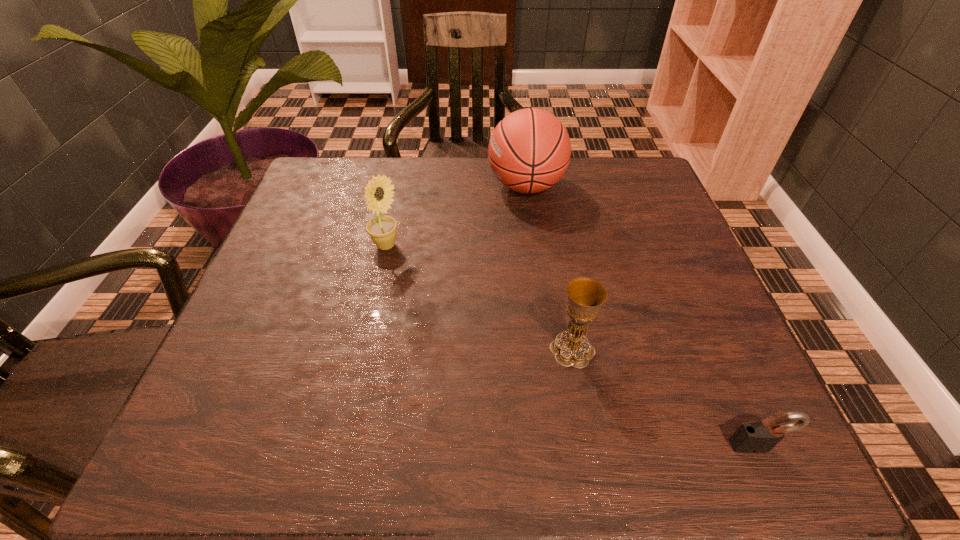
Find the location of a particular element. Image resolution: width=960 pixels, height=540 pixels. blank space located 0.370m on the face of the leftmost object is located at coordinates (566, 246).

You are a GUI agent. You are given a task and a screenshot of the screen. Output one action in this format:
    pyautogui.click(x=<x>, y=<y>)
    Task: Click on the free space located on the left of the second nearest object
    
    Given the screenshot: What is the action you would take?
    pyautogui.click(x=340, y=349)

Locate an element on the screen. object at the far edge is located at coordinates (529, 151).

The image size is (960, 540). What are the coordinates of `object that is at the near edge` in the screenshot? It's located at (756, 437).

You are a GUI agent. You are given a task and a screenshot of the screen. Output one action in this format:
    pyautogui.click(x=<x>, y=<y>)
    Task: Click on the object present at the right edge
    
    Given the screenshot: What is the action you would take?
    pyautogui.click(x=756, y=437)

Locate an element on the screen. The height and width of the screenshot is (540, 960). object that is at the near right corner is located at coordinates (756, 437).

At what (x,y) coordinates should I click in order to perform the action: click on free space at the far edge of the desktop. Please return your answer as a coordinate pair (x, y). Looking at the image, I should click on (460, 158).

Where is `vacant area at the near edge of the desktop`? Image resolution: width=960 pixels, height=540 pixels. vacant area at the near edge of the desktop is located at coordinates (424, 456).

The height and width of the screenshot is (540, 960). I want to click on vacant space at the left edge of the desktop, so click(280, 289).

Identify the location of vacant space at the right edge of the desktop. Image resolution: width=960 pixels, height=540 pixels. (711, 338).